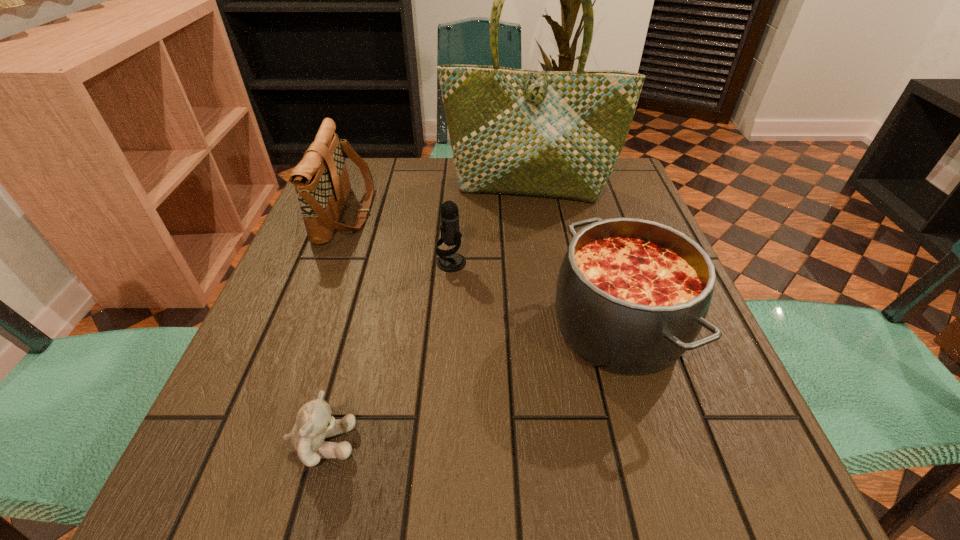
At what (x,y) coordinates should I click in order to perform the action: click on vacant space located on the face of the shortest object. Please return your answer as a coordinate pair (x, y). The width and height of the screenshot is (960, 540). Looking at the image, I should click on (557, 443).

You are a GUI agent. You are given a task and a screenshot of the screen. Output one action in this format:
    pyautogui.click(x=<x>, y=<y>)
    Task: Click on the shopping bag at the far edge
    This screenshot has width=960, height=540.
    Given the screenshot: What is the action you would take?
    pyautogui.click(x=559, y=134)

The width and height of the screenshot is (960, 540). Identify the location of shoulder bag that is at the far edge. coord(321,181).

This screenshot has height=540, width=960. Identify the location of object that is at the near edge. (314, 422).

The width and height of the screenshot is (960, 540). I want to click on shoulder bag that is at the left edge, so click(321, 181).

You are a GUI agent. You are given a task and a screenshot of the screen. Output one action in this format:
    pyautogui.click(x=<x>, y=<y>)
    Task: Click on the teddy bear that is positioned at the left edge
    
    Given the screenshot: What is the action you would take?
    pyautogui.click(x=314, y=422)

This screenshot has height=540, width=960. In order to click on shopping bag situated at the right edge in this screenshot , I will do `click(559, 134)`.

This screenshot has height=540, width=960. I want to click on casserole that is positioned at the right edge, so click(x=632, y=295).

This screenshot has width=960, height=540. I want to click on object situated at the far left corner, so click(x=321, y=181).

The image size is (960, 540). I want to click on object present at the near left corner, so click(x=314, y=422).